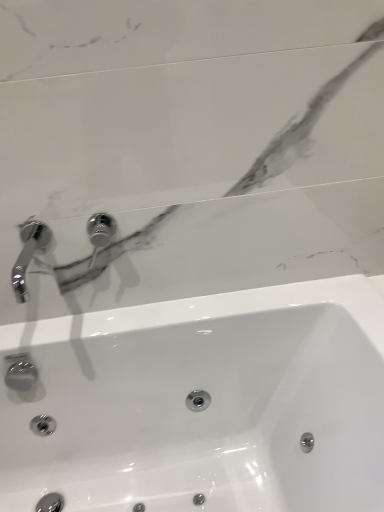
What do you see at coordinates (100, 233) in the screenshot?
I see `polished chrome tap at upper center, the first tap from the right` at bounding box center [100, 233].

This screenshot has width=384, height=512. Identify the location of chrome metallic faucet at upper left, the first tap viewed from the left. (28, 254).

Which is correct: white glossy sink at center is inside polished chrome tap at upper center, positioned as the second tap in left-to-right order, or outside of it?

white glossy sink at center is outside polished chrome tap at upper center, positioned as the second tap in left-to-right order.

Is white glossy sink at center in contact with polished chrome tap at upper center, the first tap from the right?

No, white glossy sink at center is not next to polished chrome tap at upper center, the first tap from the right.

Which object is closer to the camera, white glossy sink at center or polished chrome tap at upper center, positioned as the second tap in left-to-right order?

Positioned in front is white glossy sink at center.

Is white glossy sink at center to the left of polished chrome tap at upper center, the first tap from the right, from the viewer's perspective?

Incorrect, white glossy sink at center is not on the left side of polished chrome tap at upper center, the first tap from the right.

Which of these two, white glossy sink at center or chrome metallic faucet at upper left, marked as the second tap in a right-to-left arrangement, stands taller?

white glossy sink at center is taller.

From the image's perspective, between white glossy sink at center and chrome metallic faucet at upper left, the first tap viewed from the left, who is located below?

white glossy sink at center, from the image's perspective.

Could you tell me if white glossy sink at center is facing chrome metallic faucet at upper left, the first tap viewed from the left?

No, white glossy sink at center is not turned towards chrome metallic faucet at upper left, the first tap viewed from the left.

In the scene shown: Who is bigger, white glossy sink at center or chrome metallic faucet at upper left, the first tap viewed from the left?

white glossy sink at center.

Considering the relative sizes of polished chrome tap at upper center, the first tap from the right, and white glossy sink at center in the image provided, is polished chrome tap at upper center, the first tap from the right, smaller than white glossy sink at center?

Yes, polished chrome tap at upper center, the first tap from the right, is smaller than white glossy sink at center.

I want to click on sink on the right of polished chrome tap at upper center, positioned as the second tap in left-to-right order, so click(x=202, y=403).

Is point (105, 247) positioned before point (129, 460)?

Yes.

From the image's perspective, is polished chrome tap at upper center, positioned as the second tap in left-to-right order, on white glossy sink at center?

Yes.

At what (x,y) coordinates should I click in order to perform the action: click on tap located above the chrome metallic faucet at upper left, marked as the second tap in a right-to-left arrangement (from the image's perspective). Please return your answer as a coordinate pair (x, y). This screenshot has width=384, height=512. Looking at the image, I should click on (100, 233).

Which is more to the right, chrome metallic faucet at upper left, marked as the second tap in a right-to-left arrangement, or polished chrome tap at upper center, the first tap from the right?

From the viewer's perspective, polished chrome tap at upper center, the first tap from the right, appears more on the right side.

Is polished chrome tap at upper center, positioned as the second tap in left-to-right order, at the back of chrome metallic faucet at upper left, marked as the second tap in a right-to-left arrangement?

That's not correct — chrome metallic faucet at upper left, marked as the second tap in a right-to-left arrangement, is not looking away from polished chrome tap at upper center, positioned as the second tap in left-to-right order.

Considering the sizes of chrome metallic faucet at upper left, the first tap viewed from the left, and polished chrome tap at upper center, positioned as the second tap in left-to-right order, in the image, is chrome metallic faucet at upper left, the first tap viewed from the left, wider or thinner than polished chrome tap at upper center, positioned as the second tap in left-to-right order,?

Clearly, chrome metallic faucet at upper left, the first tap viewed from the left, has more width compared to polished chrome tap at upper center, positioned as the second tap in left-to-right order.

Is white glossy sink at center located within chrome metallic faucet at upper left, the first tap viewed from the left?

No, white glossy sink at center is not inside chrome metallic faucet at upper left, the first tap viewed from the left.

Which of these two, chrome metallic faucet at upper left, marked as the second tap in a right-to-left arrangement, or white glossy sink at center, is bigger?

Bigger between the two is white glossy sink at center.

From a real-world perspective, count 2nd taps upward from the white glossy sink at center and point to it. Please provide its 2D coordinates.

[(28, 254)]

Can you confirm if polished chrome tap at upper center, positioned as the second tap in left-to-right order, is thinner than chrome metallic faucet at upper left, marked as the second tap in a right-to-left arrangement?

Yes.

From the picture: Is polished chrome tap at upper center, positioned as the second tap in left-to-right order, bigger than chrome metallic faucet at upper left, the first tap viewed from the left?

No.

Does polished chrome tap at upper center, positioned as the second tap in left-to-right order, appear on the left side of chrome metallic faucet at upper left, marked as the second tap in a right-to-left arrangement?

No.

Is point (112, 228) positioned in front of point (28, 241)?

No, it is behind (28, 241).

Find the location of a particular element. The height and width of the screenshot is (512, 384). the 1st tap counting from the left side of the white glossy sink at center is located at coordinates (100, 233).

Starting from the white glossy sink at center, which tap is the 1st one behind? Please provide its 2D coordinates.

[(28, 254)]

Estimate the real-world distances between objects in this image. Which object is further from polished chrome tap at upper center, positioned as the second tap in left-to-right order, chrome metallic faucet at upper left, the first tap viewed from the left, or white glossy sink at center?

white glossy sink at center is further to polished chrome tap at upper center, positioned as the second tap in left-to-right order.

From the image, which object appears to be farther from chrome metallic faucet at upper left, the first tap viewed from the left, white glossy sink at center or polished chrome tap at upper center, positioned as the second tap in left-to-right order?

white glossy sink at center is positioned further to the anchor chrome metallic faucet at upper left, the first tap viewed from the left.

Estimate the real-world distances between objects in this image. Which object is further from chrome metallic faucet at upper left, the first tap viewed from the left, polished chrome tap at upper center, positioned as the second tap in left-to-right order, or white glossy sink at center?

Based on the image, white glossy sink at center appears to be further to chrome metallic faucet at upper left, the first tap viewed from the left.

Considering their positions, is chrome metallic faucet at upper left, marked as the second tap in a right-to-left arrangement, positioned closer to white glossy sink at center than polished chrome tap at upper center, positioned as the second tap in left-to-right order?

polished chrome tap at upper center, positioned as the second tap in left-to-right order.

When comparing their distances from white glossy sink at center, does polished chrome tap at upper center, the first tap from the right, or chrome metallic faucet at upper left, marked as the second tap in a right-to-left arrangement, seem closer?

polished chrome tap at upper center, the first tap from the right, is positioned closer to the anchor white glossy sink at center.

Looking at the image, which one is located closer to polished chrome tap at upper center, positioned as the second tap in left-to-right order, white glossy sink at center or chrome metallic faucet at upper left, the first tap viewed from the left?

chrome metallic faucet at upper left, the first tap viewed from the left, is positioned closer to the anchor polished chrome tap at upper center, positioned as the second tap in left-to-right order.

The height and width of the screenshot is (512, 384). Find the location of `tap that lies between polished chrome tap at upper center, positioned as the second tap in left-to-right order, and white glossy sink at center from top to bottom`. tap that lies between polished chrome tap at upper center, positioned as the second tap in left-to-right order, and white glossy sink at center from top to bottom is located at coordinates (28, 254).